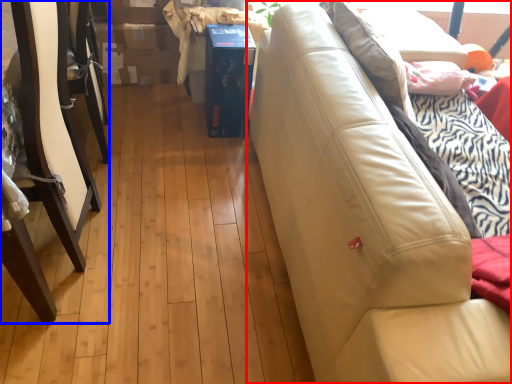
Question: Among these objects, which one is nearest to the camera, studio couch (highlighted by a red box) or furniture (highlighted by a blue box)?

Choices:
 (A) studio couch
 (B) furniture

Answer: (A)